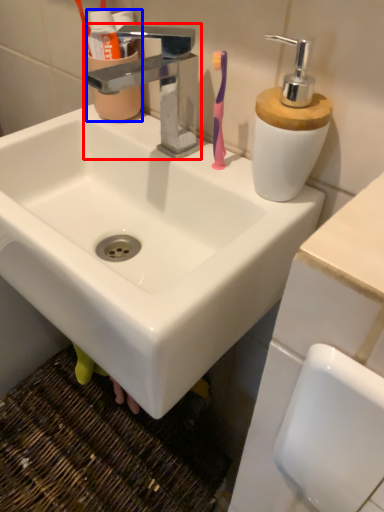
Question: Which of the following is the closest to the observer, tap (highlighted by a red box) or mouthwash (highlighted by a blue box)?

Choices:
 (A) tap
 (B) mouthwash

Answer: (A)